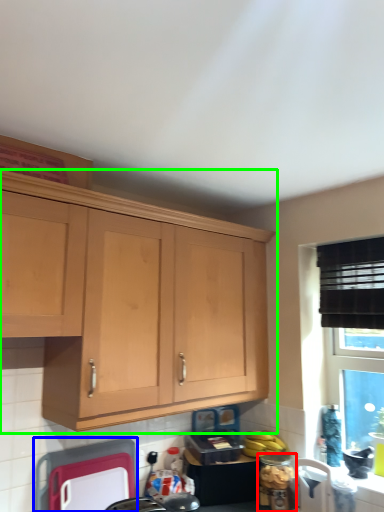
Question: Based on their relative distances, which object is farther from appliance (highlighted by a red box)? Choose from appliance (highlighted by a blue box) and cabinetry (highlighted by a green box).

Choices:
 (A) appliance
 (B) cabinetry

Answer: (B)